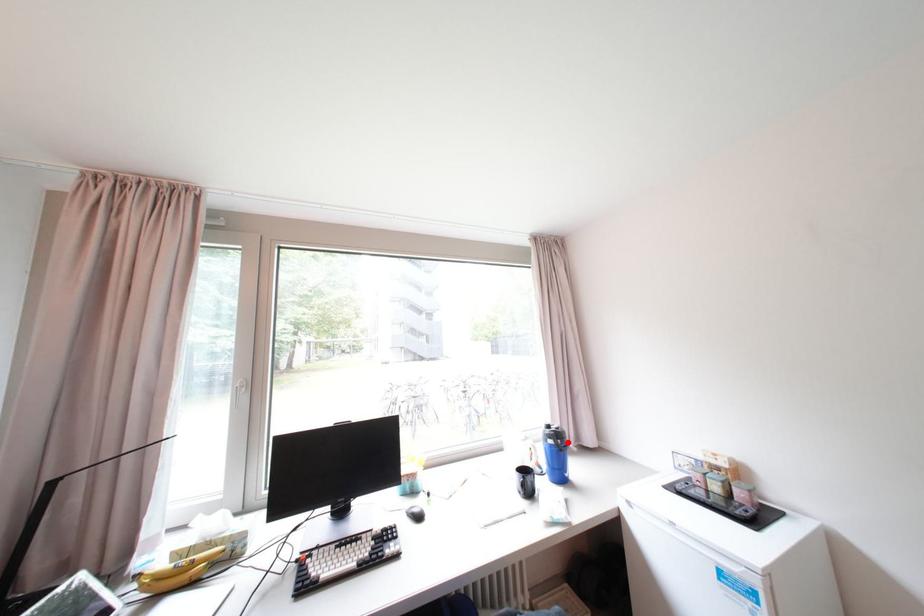
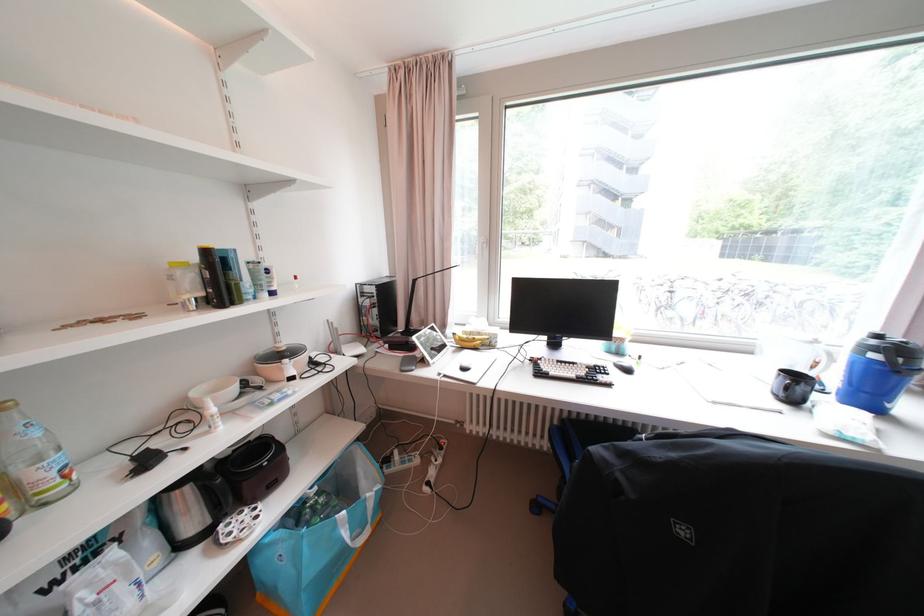
The point at the highlighted location is marked in the first image. Where is the corresponding point in the second image?

(909, 361)